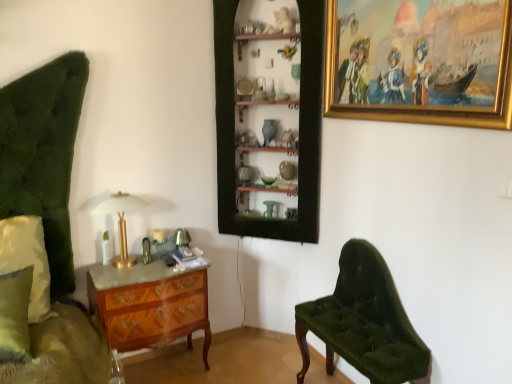
At what (x,y) coordinates should I click in order to perform the action: click on free space above wooden marquetry chest of drawers at lower left (from a real-world perspective). Please return your answer as a coordinate pair (x, y). The width and height of the screenshot is (512, 384). Looking at the image, I should click on (155, 266).